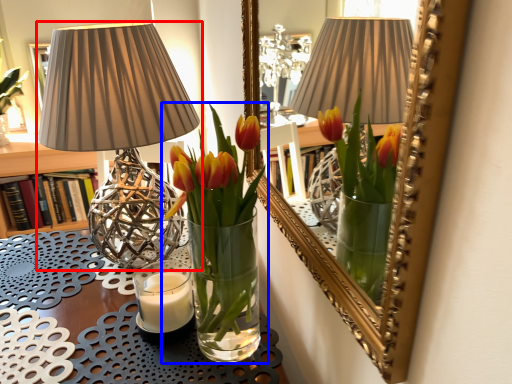
Question: Which object appears farthest to the camera in this image, lamp (highlighted by a red box) or houseplant (highlighted by a blue box)?

Choices:
 (A) lamp
 (B) houseplant

Answer: (A)